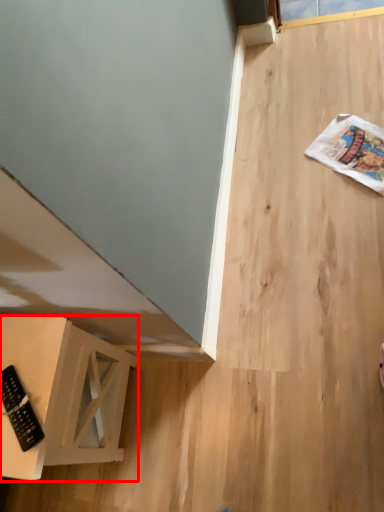
Question: From the image's perspective, what is the correct spatial relationship of furniture (annotated by the red box) in relation to control?

Choices:
 (A) above
 (B) below

Answer: (B)